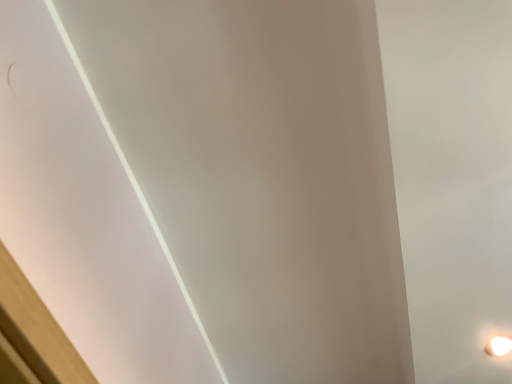
Where is `white glossy lamp at lower right`? The image size is (512, 384). white glossy lamp at lower right is located at coordinates (498, 346).

What do you see at coordinates (498, 346) in the screenshot?
I see `white glossy lamp at lower right` at bounding box center [498, 346].

Image resolution: width=512 pixels, height=384 pixels. Identify the location of white glossy lamp at lower right. (498, 346).